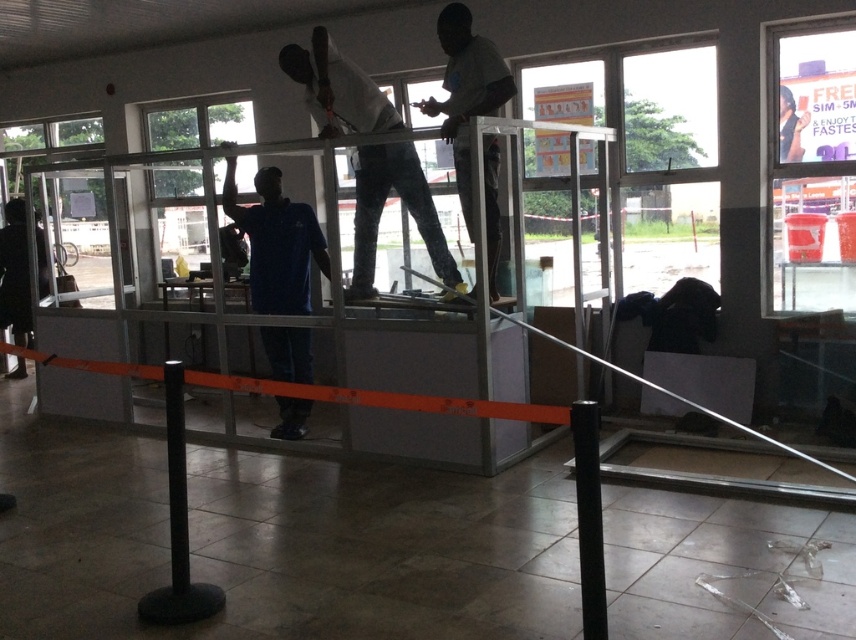
Question: Which point is farther to the camera?

Choices:
 (A) white matte shirt at upper center
 (B) blue cotton shirt at center

Answer: (B)

Question: Which point appears closest to the camera in this image?

Choices:
 (A) (783, 45)
 (B) (311, 230)
 (C) (462, 145)
 (D) (444, 252)

Answer: (C)

Question: Does light blue shirt at center appear over black rubber pole at lower left?

Choices:
 (A) yes
 (B) no

Answer: (A)

Question: Does light blue shirt at center have a larger size compared to blue cotton shirt at center?

Choices:
 (A) yes
 (B) no

Answer: (A)

Question: Considering the real-world distances, which object is farthest from the transparent glass window at upper right?

Choices:
 (A) white matte shirt at upper center
 (B) black rubber pole at lower left
 (C) light blue shirt at center
 (D) blue cotton shirt at center

Answer: (B)

Question: Is light blue shirt at center below black rubber pole at lower left?

Choices:
 (A) yes
 (B) no

Answer: (B)